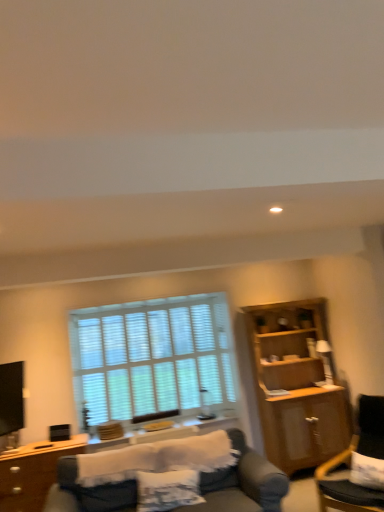
Question: Do you think brown wood desk at lower left is within white wood blinds at center, or outside of it?

Choices:
 (A) outside
 (B) inside

Answer: (A)

Question: From the image's perspective, is brown wood desk at lower left located above or below white wood blinds at center?

Choices:
 (A) below
 (B) above

Answer: (A)

Question: Estimate the real-world distances between objects in this image. Which object is farther from the wooden side table at lower center?

Choices:
 (A) white wood blinds at center
 (B) dark gray fabric chair at lower right
 (C) wooden cabinet at right
 (D) brown wood desk at lower left

Answer: (C)

Question: Considering the real-world distances, which object is farthest from the dark gray fabric chair at lower right?

Choices:
 (A) white wood blinds at center
 (B) wooden cabinet at right
 (C) brown wood desk at lower left
 (D) wooden side table at lower center

Answer: (C)